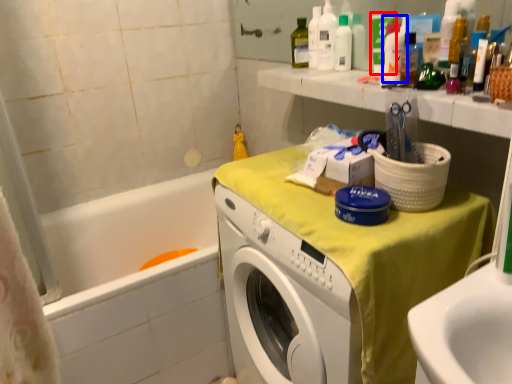
Question: Which point is further to the camera, toiletry (highlighted by a red box) or cleaning product (highlighted by a blue box)?

Choices:
 (A) toiletry
 (B) cleaning product

Answer: (A)